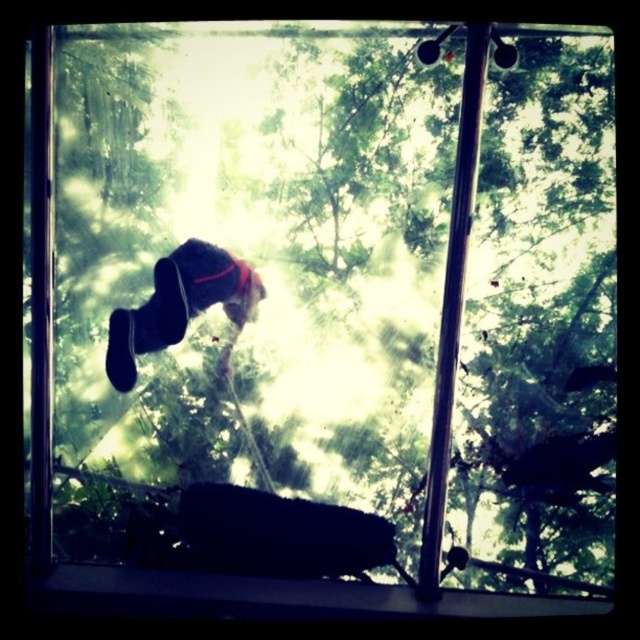
Question: Can you confirm if black plastic window sill at lower center is positioned below black suede shoes at center?

Choices:
 (A) no
 (B) yes

Answer: (B)

Question: Does black plastic window sill at lower center appear on the right side of black suede shoes at center?

Choices:
 (A) yes
 (B) no

Answer: (A)

Question: Which point appears farthest from the camera in this image?

Choices:
 (A) (461, 600)
 (B) (189, 285)

Answer: (B)

Question: Which point is closer to the camera?

Choices:
 (A) (193, 259)
 (B) (116, 577)

Answer: (B)

Question: Is black plastic window sill at lower center below black suede shoes at center?

Choices:
 (A) no
 (B) yes

Answer: (B)